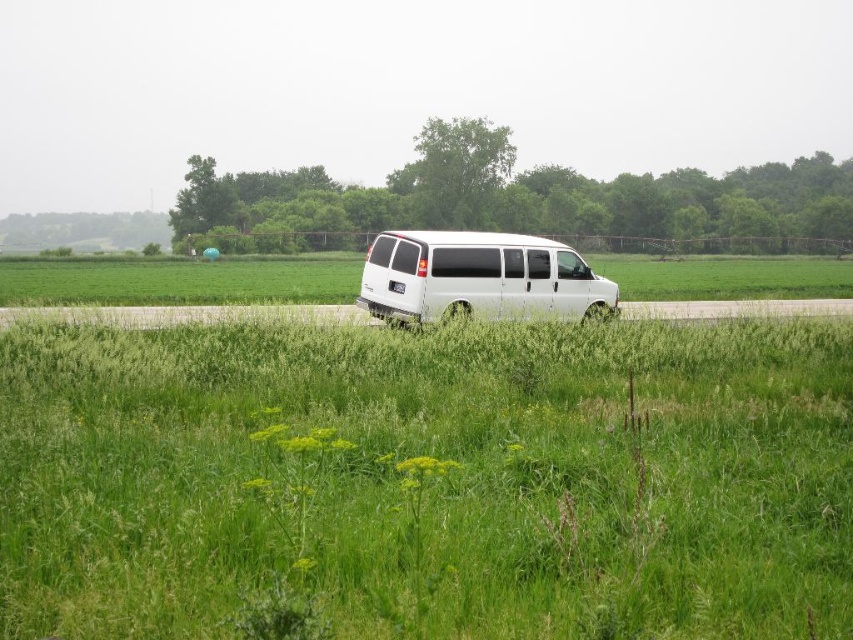
Is green grassy at center smaller than white matte van at center?

Incorrect, green grassy at center is not smaller in size than white matte van at center.

Between green grassy at center and white matte van at center, which one appears on the left side from the viewer's perspective?

Positioned to the left is green grassy at center.

Image resolution: width=853 pixels, height=640 pixels. What do you see at coordinates (426, 477) in the screenshot? I see `green grassy at center` at bounding box center [426, 477].

Locate an element on the screen. Image resolution: width=853 pixels, height=640 pixels. green grassy at center is located at coordinates (426, 477).